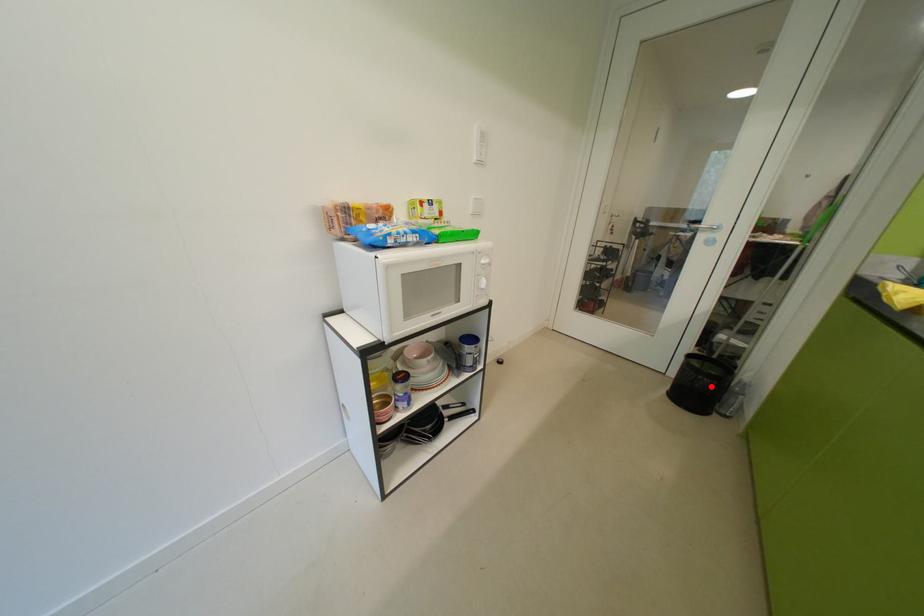
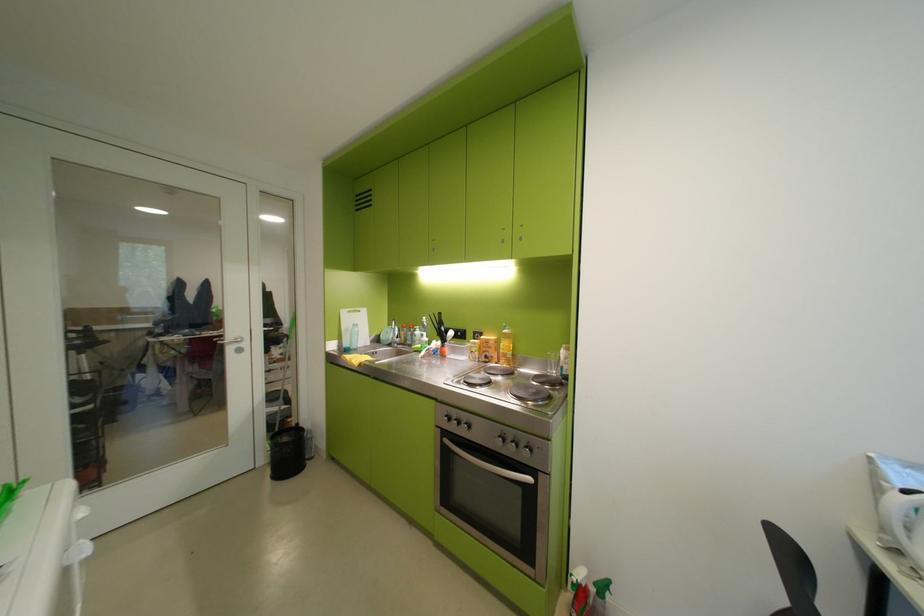
Locate, in the second image, the point that corresponds to the highlighted location in the first image.

(299, 453)